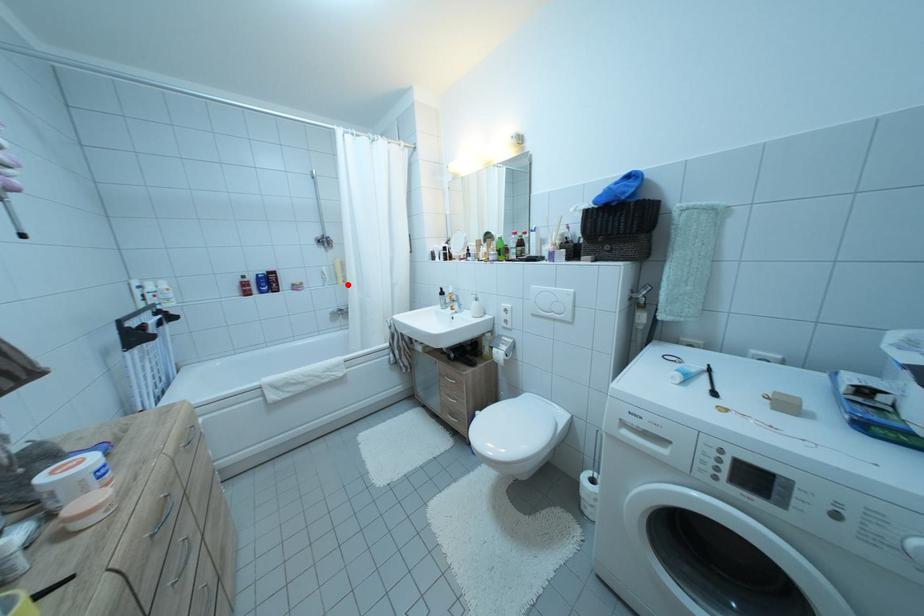
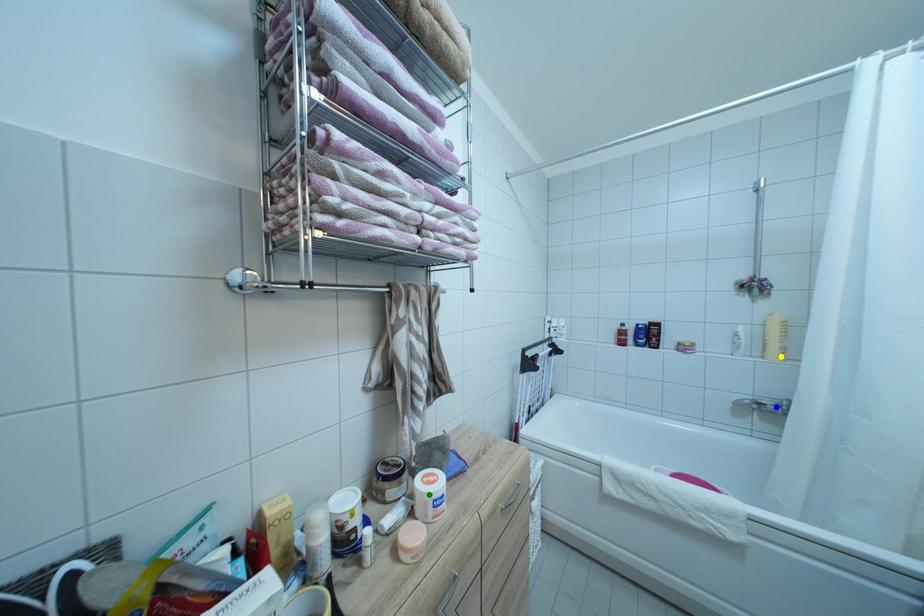
Question: I am providing you with two images of the same scene from different viewpoints. A red point is marked on the first image. You are given multiple points on the second image. Which spot in image 2 lines up with the point in image 1?

Choices:
 (A) green point
 (B) yellow point
 (C) blue point

Answer: (B)